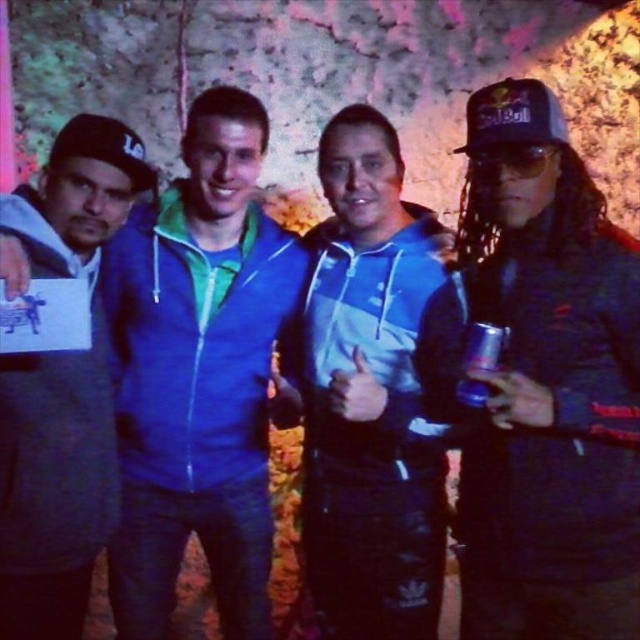
Question: Does shiny black jacket at right have a lesser width compared to blue metallic can at right?

Choices:
 (A) no
 (B) yes

Answer: (A)

Question: Is gray hoodie at left bigger than blue metallic can at right?

Choices:
 (A) no
 (B) yes

Answer: (B)

Question: Which point appears closest to the camera in this image?

Choices:
 (A) (406, 316)
 (B) (486, 499)
 (C) (236, 436)

Answer: (B)

Question: Considering the real-world distances, which object is closest to the blue metallic can at right?

Choices:
 (A) blue zip-up hoodie at center
 (B) gray hoodie at left

Answer: (A)

Question: Does shiny black jacket at right have a smaller size compared to blue metallic can at right?

Choices:
 (A) yes
 (B) no

Answer: (B)

Question: Which object is farther from the camera taking this photo?

Choices:
 (A) blue zip-up jacket at center
 (B) shiny black jacket at right

Answer: (A)